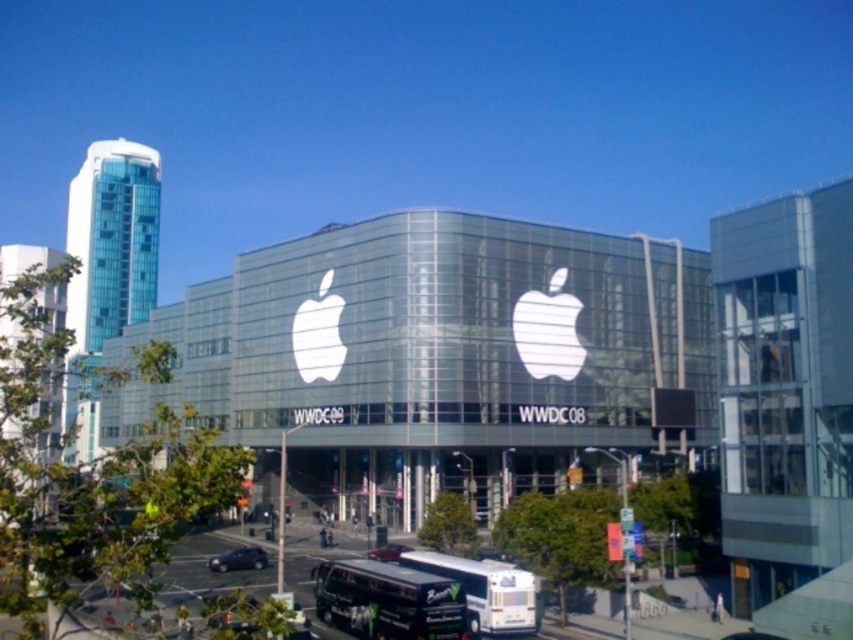
You are a pedestrian standing on the sidewalk in front of the large glass building. You see the white glossy bus at lower center and the shiny black sedan at center. Which vehicle is closer to you?

The shiny black sedan at center is closer to you because the white glossy bus at lower center is located above it, meaning the sedan is positioned lower in the image and thus nearer to the observer.

You are a delivery person who needs to load a package onto a truck. The truck has a height restriction of 2 meters. You observe the black matte bus at lower center and the shiny black sedan at center in the scene. Which vehicle can safely pass under the truck without hitting the height restriction?

The shiny black sedan at center can safely pass under the truck since it has a smaller height than the black matte bus at lower center, which is taller and might exceed the 2 meter height restriction.